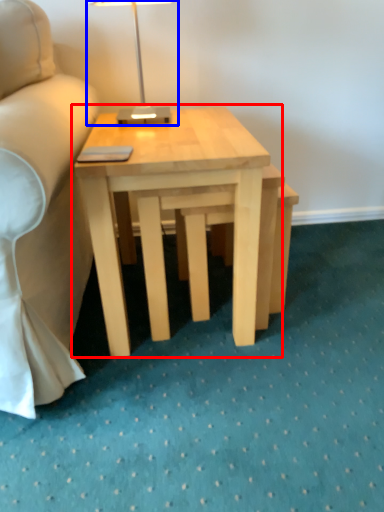
Question: Which object is closer to the camera taking this photo, coffee table (highlighted by a red box) or table lamp (highlighted by a blue box)?

Choices:
 (A) coffee table
 (B) table lamp

Answer: (A)